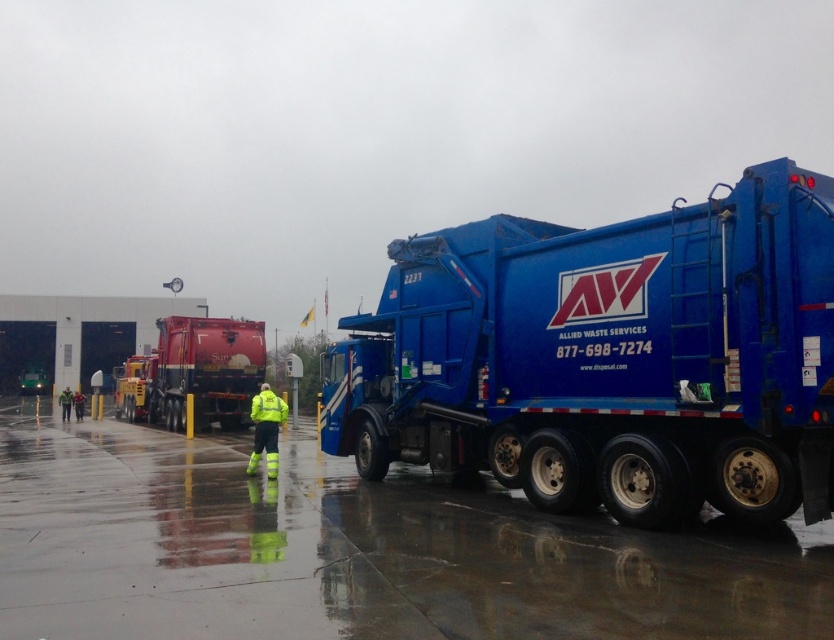
Question: Based on their relative distances, which object is farther from the high visibility yellow safety vest at center?

Choices:
 (A) yellow reflective jacket at center
 (B) red glossy truck at center
 (C) blue matte/glossy garbage truck at right

Answer: (B)

Question: Among these objects, which one is farthest from the camera?

Choices:
 (A) blue matte/glossy garbage truck at right
 (B) yellow reflective jacket at center
 (C) high visibility yellow safety vest at center
 (D) red glossy truck at center

Answer: (D)

Question: Does yellow reflective jacket at center have a smaller size compared to high visibility yellow safety vest at center?

Choices:
 (A) no
 (B) yes

Answer: (A)

Question: Does red glossy truck at center lie behind yellow reflective jacket at center?

Choices:
 (A) yes
 (B) no

Answer: (A)

Question: Which of these objects is positioned closest to the high visibility yellow safety vest at center?

Choices:
 (A) yellow reflective jacket at center
 (B) red glossy truck at center

Answer: (A)

Question: Does blue matte/glossy garbage truck at right have a lesser width compared to red glossy truck at center?

Choices:
 (A) yes
 (B) no

Answer: (A)